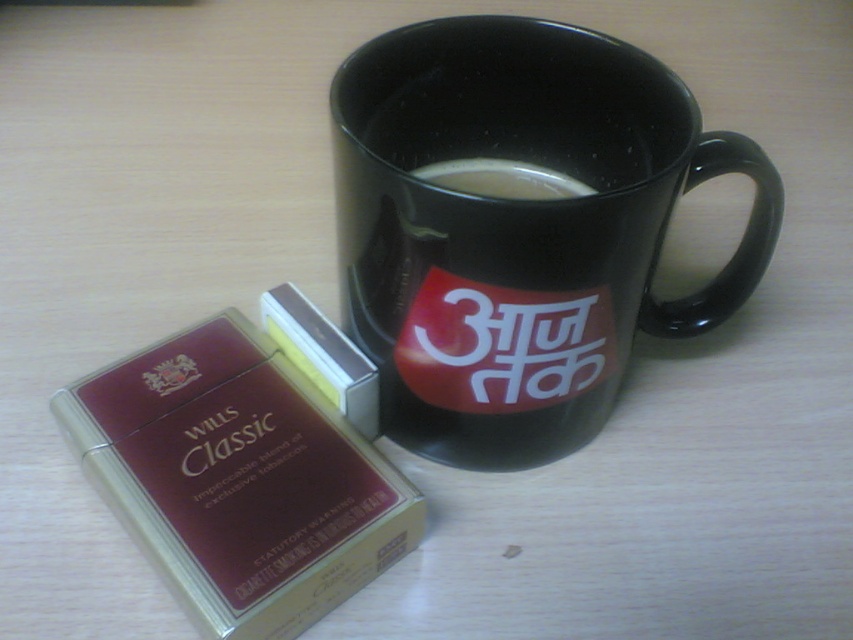
Does point (701, 144) come closer to viewer compared to point (491, 168)?

Yes, it is in front of point (491, 168).

How far apart are black ceramic mug at upper center and white glossy coffee at upper center?

black ceramic mug at upper center and white glossy coffee at upper center are 8.57 inches apart from each other.

Between point (578, 280) and point (422, 176), which one is positioned in front?

Point (578, 280) is more forward.

This screenshot has width=853, height=640. In order to click on black ceramic mug at upper center in this screenshot , I will do `click(519, 228)`.